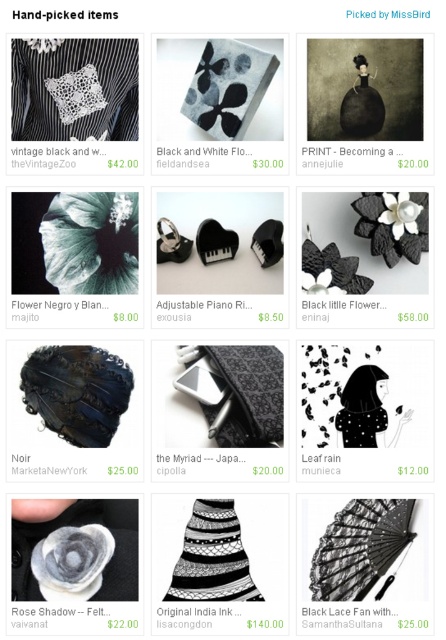
You are a customer looking at the grid layout of twelve items in the Handpicked items section. You see the black lace crochet at center. Where exactly is it located in the grid? Please provide coordinates.

The black lace crochet at center is located at coordinates point (x=236, y=392).